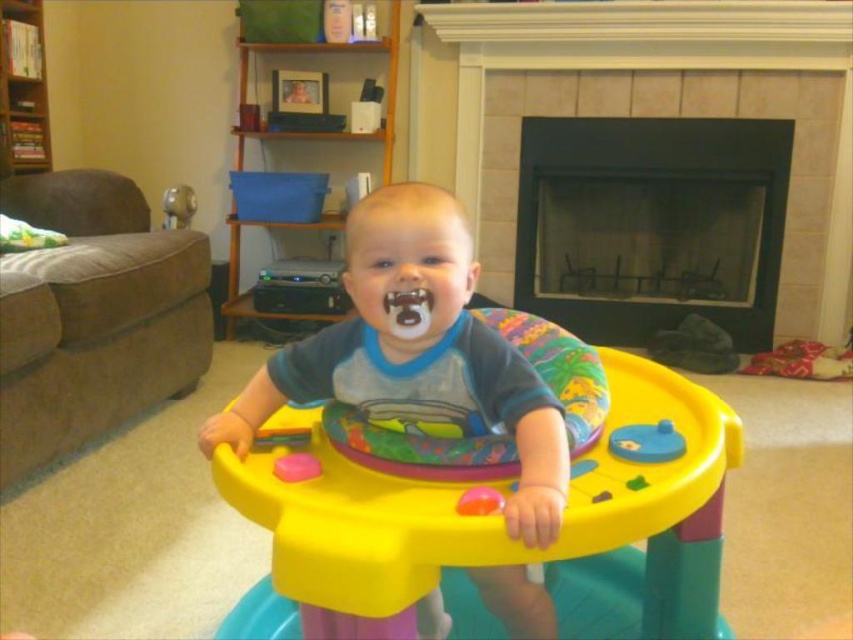
Does smooth stone fireplace at center appear on the left side of black tile fireplace at center?

Correct, you'll find smooth stone fireplace at center to the left of black tile fireplace at center.

Between point (410, 88) and point (730, 259), which one is positioned in front?

Point (730, 259)

Locate an element on the screen. Image resolution: width=853 pixels, height=640 pixels. smooth stone fireplace at center is located at coordinates (659, 112).

Is matte plastic walker at center to the right of blue rubber toy at center from the viewer's perspective?

Incorrect, matte plastic walker at center is not on the right side of blue rubber toy at center.

Who is more distant from viewer, (346, 236) or (659, 433)?

The point (659, 433) is behind.

Find the location of a particular element. The height and width of the screenshot is (640, 853). matte plastic walker at center is located at coordinates (416, 355).

From the picture: Does smooth stone fireplace at center have a lesser width compared to rubberized plastic toy at center?

Incorrect, smooth stone fireplace at center's width is not less than rubberized plastic toy at center's.

From the picture: Is smooth stone fireplace at center closer to camera compared to rubberized plastic toy at center?

No, it is behind rubberized plastic toy at center.

Is point (639, 20) more distant than point (285, 477)?

Yes, point (639, 20) is farther from viewer.

The width and height of the screenshot is (853, 640). In order to click on smooth stone fireplace at center in this screenshot , I will do `click(659, 112)`.